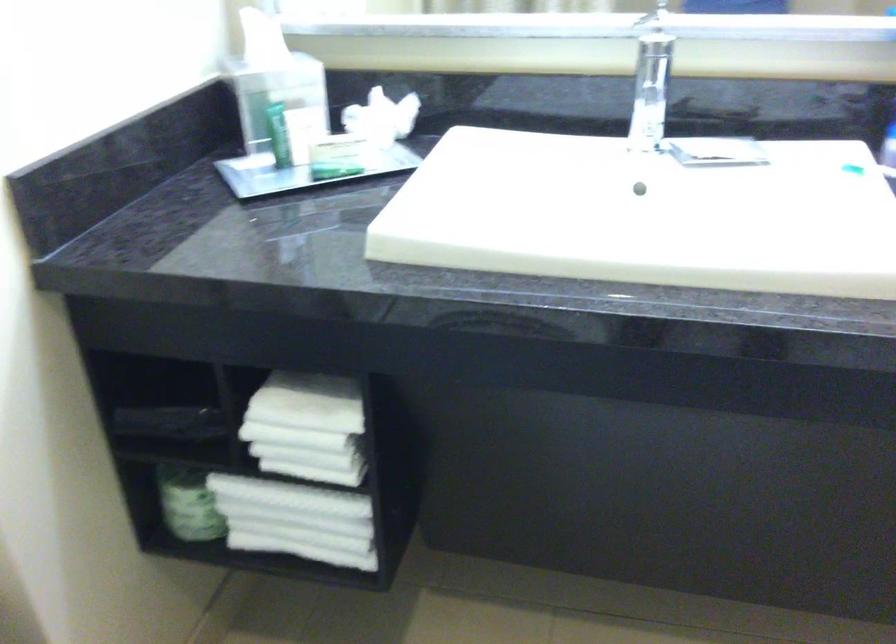
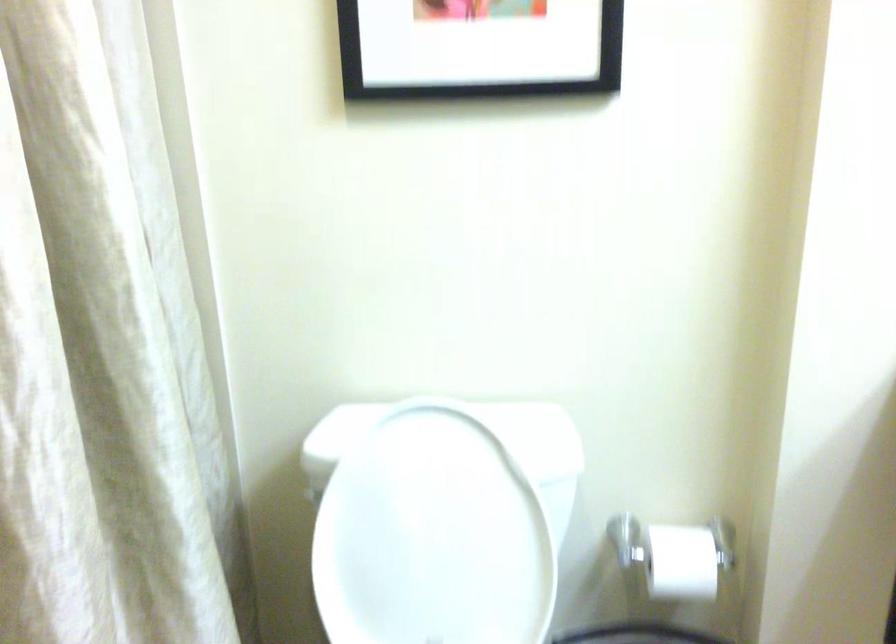
Question: How did the camera likely rotate?

Choices:
 (A) Left
 (B) Right
 (C) Up
 (D) Down

Answer: (A)